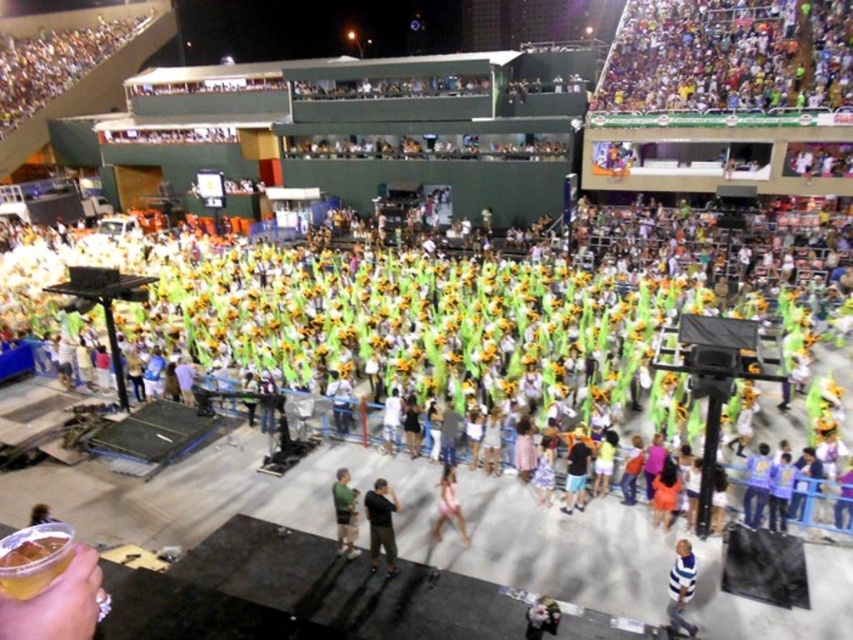
Question: Does black matte shirt at center appear on the left side of blue striped shirt at lower right?

Choices:
 (A) yes
 (B) no

Answer: (A)

Question: Is green fabric crowd at upper center to the right of black matte shirt at center from the viewer's perspective?

Choices:
 (A) no
 (B) yes

Answer: (A)

Question: Among these objects, which one is farthest from the camera?

Choices:
 (A) green fabric shirt at center
 (B) multicolored fabric crowd at upper right
 (C) black cotton shorts at center

Answer: (B)

Question: Which point is farther from the camera taking this photo?

Choices:
 (A) tap(355, 496)
 (B) tap(669, 595)
 (C) tap(604, 99)

Answer: (C)

Question: Does green fabric crowd at upper center lie behind black cotton shorts at center?

Choices:
 (A) yes
 (B) no

Answer: (A)

Question: Which point is farther to the camera?

Choices:
 (A) click(19, 83)
 (B) click(387, 490)
 (C) click(573, 484)
 (D) click(682, 616)

Answer: (A)